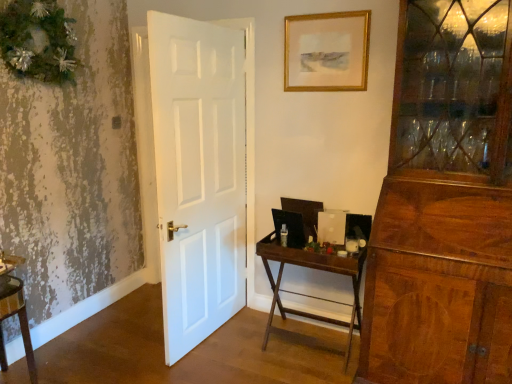
Question: Is wooden folding table at center at the left side of green textured wreath at upper left?

Choices:
 (A) yes
 (B) no

Answer: (B)

Question: Is wooden folding table at center next to green textured wreath at upper left?

Choices:
 (A) yes
 (B) no

Answer: (B)

Question: Can you confirm if wooden folding table at center is positioned to the right of green textured wreath at upper left?

Choices:
 (A) no
 (B) yes

Answer: (B)

Question: Could green textured wreath at upper left be considered to be inside wooden folding table at center?

Choices:
 (A) no
 (B) yes

Answer: (A)

Question: Is wooden folding table at center completely or partially outside of green textured wreath at upper left?

Choices:
 (A) no
 (B) yes

Answer: (B)

Question: Does wooden folding table at center come behind green textured wreath at upper left?

Choices:
 (A) yes
 (B) no

Answer: (A)

Question: Is wooden folding table at center shorter than gold-framed picture at upper center?

Choices:
 (A) yes
 (B) no

Answer: (B)

Question: Is wooden folding table at center further to camera compared to gold-framed picture at upper center?

Choices:
 (A) no
 (B) yes

Answer: (A)

Question: Is wooden folding table at center outside gold-framed picture at upper center?

Choices:
 (A) yes
 (B) no

Answer: (A)

Question: From a real-world perspective, does wooden folding table at center stand above gold-framed picture at upper center?

Choices:
 (A) yes
 (B) no

Answer: (B)

Question: Is wooden folding table at center wider than gold-framed picture at upper center?

Choices:
 (A) no
 (B) yes

Answer: (B)

Question: Is wooden folding table at center facing away from gold-framed picture at upper center?

Choices:
 (A) yes
 (B) no

Answer: (B)

Question: From the image's perspective, does gold-framed picture at upper center appear lower than wooden folding table at center?

Choices:
 (A) yes
 (B) no

Answer: (B)